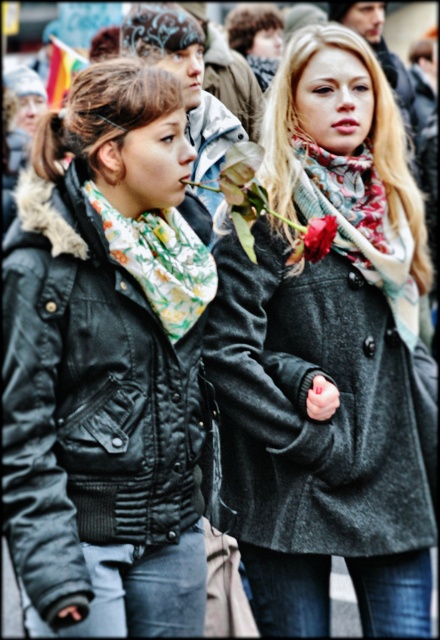
Between black leather jacket at left and red matte flower at center, which one is positioned lower?

black leather jacket at left is below.

Which is behind, point (36, 252) or point (294, 244)?

The point (294, 244) is more distant.

The width and height of the screenshot is (440, 640). In order to click on black leather jacket at left in this screenshot , I will do `click(88, 403)`.

Is black leather jacket at left behind floral printed scarf at left?

No, it is not.

Which is behind, point (25, 230) or point (99, 204)?

Point (99, 204)

Identify the location of black leather jacket at left. The image size is (440, 640). pyautogui.click(x=88, y=403).

Is floral print scarf at center taller than floral printed scarf at left?

Yes, floral print scarf at center is taller than floral printed scarf at left.

Can you confirm if floral print scarf at center is positioned to the right of floral printed scarf at left?

Yes, floral print scarf at center is to the right of floral printed scarf at left.

Who is more distant from viewer, (296,134) or (124,220)?

Point (296,134)

I want to click on floral print scarf at center, so (x=359, y=224).